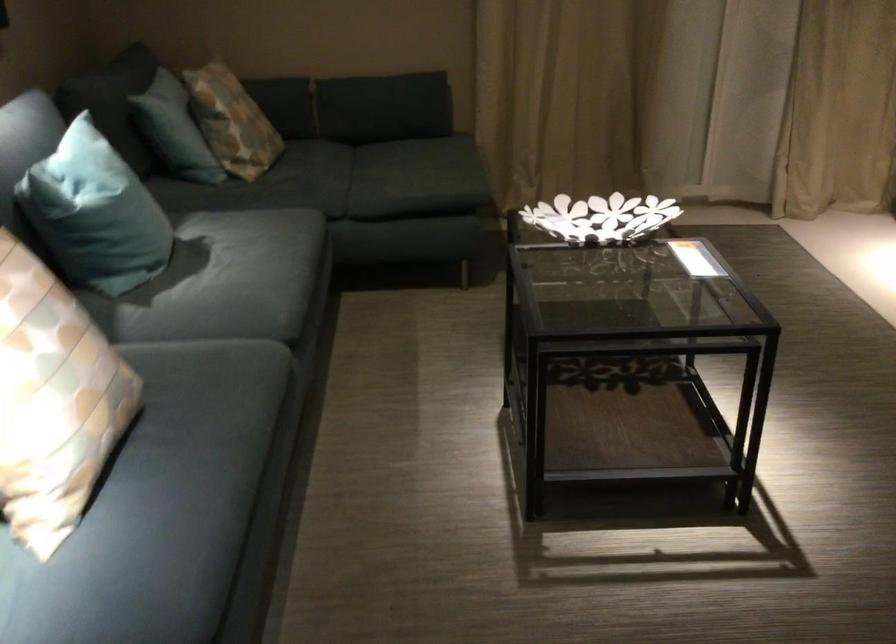
Where would you lift the white decorative bowl? Please return your answer as a coordinate pair (x, y).

(600, 218)